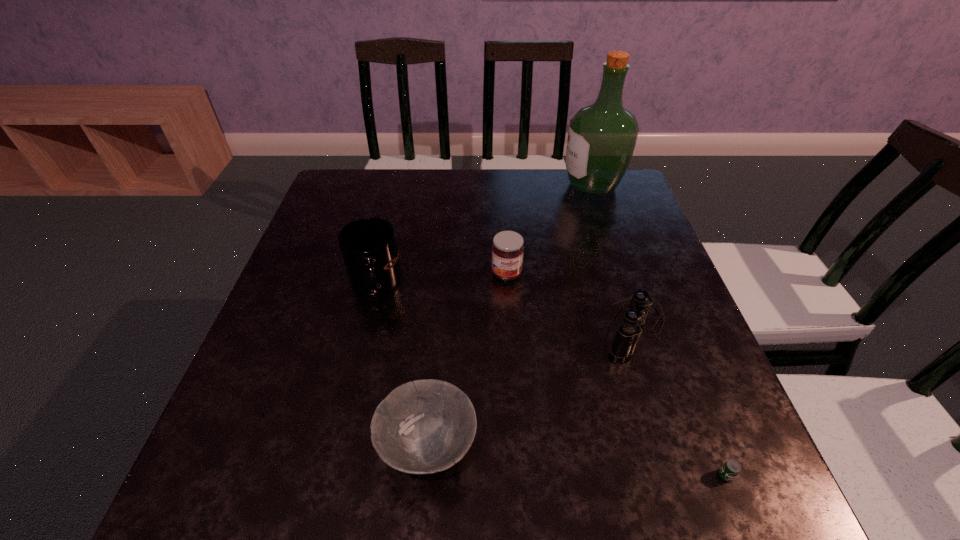
At what (x,y) coordinates should I click in order to perform the action: click on the farthest object. Please return your answer as a coordinate pair (x, y). This screenshot has height=540, width=960. Looking at the image, I should click on (601, 139).

Identify the location of liquor. (x=601, y=139).

This screenshot has width=960, height=540. I want to click on mug, so click(368, 246).

Locate an element on the screen. the second tallest object is located at coordinates (x=368, y=246).

Where is `jam`? The image size is (960, 540). jam is located at coordinates (507, 249).

The height and width of the screenshot is (540, 960). Identify the location of binoculars. (628, 333).

I want to click on the second shortest object, so click(426, 426).

You are a GUI agent. You are given a task and a screenshot of the screen. Output one action in this format:
    pyautogui.click(x=<x>, y=<y>)
    Task: Click on the bowl
    This screenshot has width=960, height=540.
    Given the screenshot: What is the action you would take?
    pyautogui.click(x=426, y=426)

The width and height of the screenshot is (960, 540). Find the location of `the shortest object`. the shortest object is located at coordinates (731, 468).

Find the location of a particular element. Image resolution: width=960 pixels, height=540 pixels. vacant space located on the front-facing side of the tallest object is located at coordinates (524, 186).